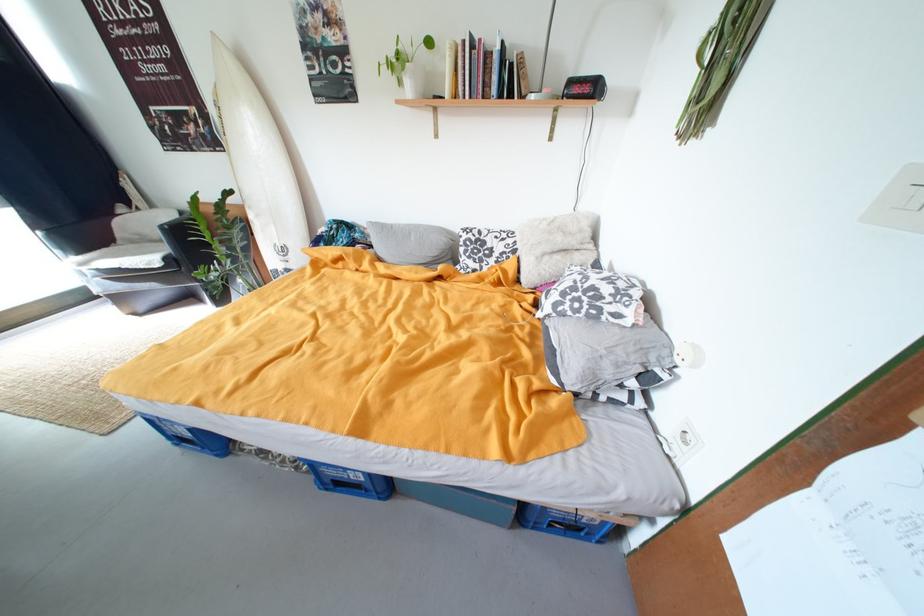
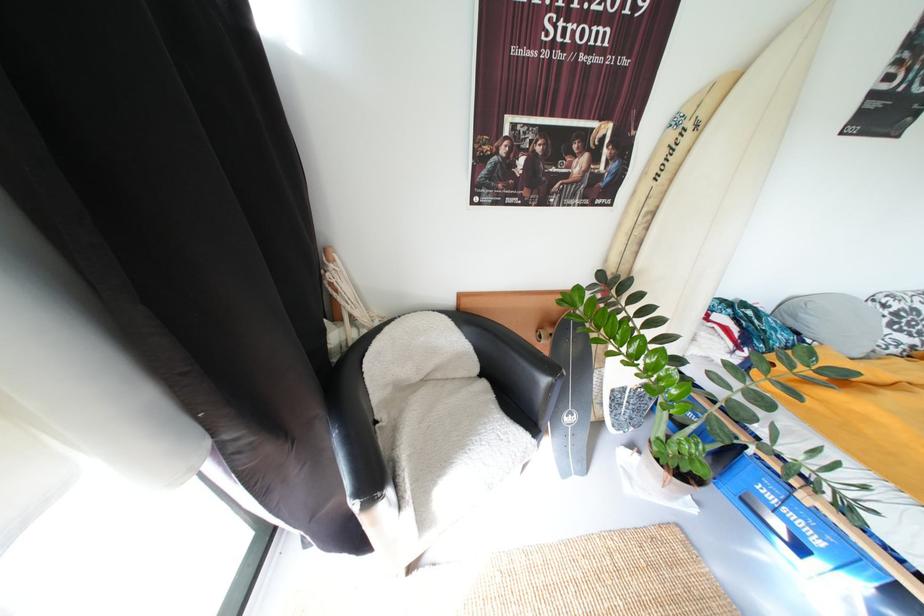
Based on the photo, which direction would the cameraman need to move to produce the second image?

The movement direction of the cameraman is left, forward.